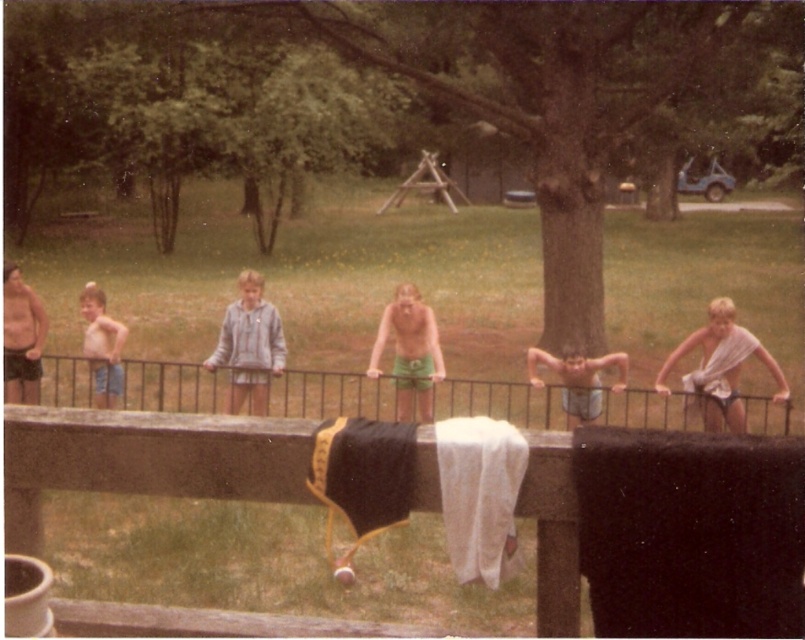
A child is standing at point (89,372). If another child is 11.40 meters away from them, where would that child be located?

The other child would be located 11.40 meters away from the point (89,372).

You are a parent trying to ensure the safety of your children playing near the pool. You notice two children wearing matte black shorts at left and light blue denim shorts at left. Which child should you warn about the risk of their clothing getting caught in the fence railing?

The matte black shorts at left might be wider than light blue denim shorts at left, so the child wearing matte black shorts at left has a higher risk of their clothing getting caught in the fence railing and should be warned.